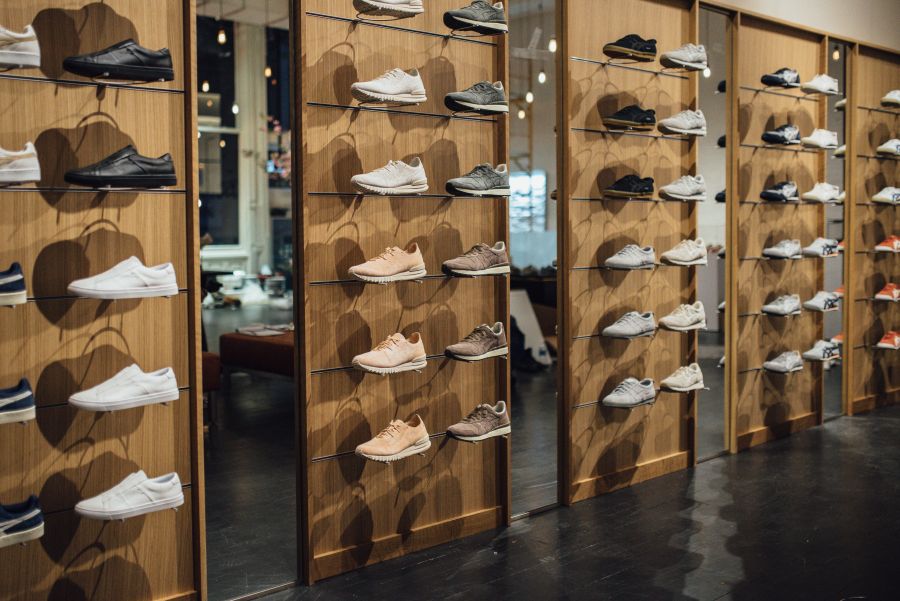
At what (x,y) coordinates should I click in order to perform the action: click on mirror. Please return your answer as a coordinate pair (x, y). Looking at the image, I should click on (237, 254), (535, 230), (709, 227), (832, 227).